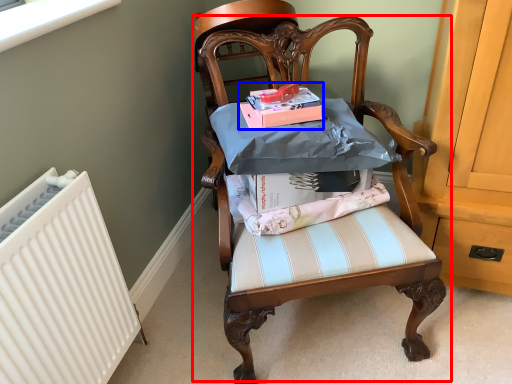
Question: Which of the following is the farthest to the observer, chair (highlighted by a red box) or magazine (highlighted by a blue box)?

Choices:
 (A) chair
 (B) magazine

Answer: (B)